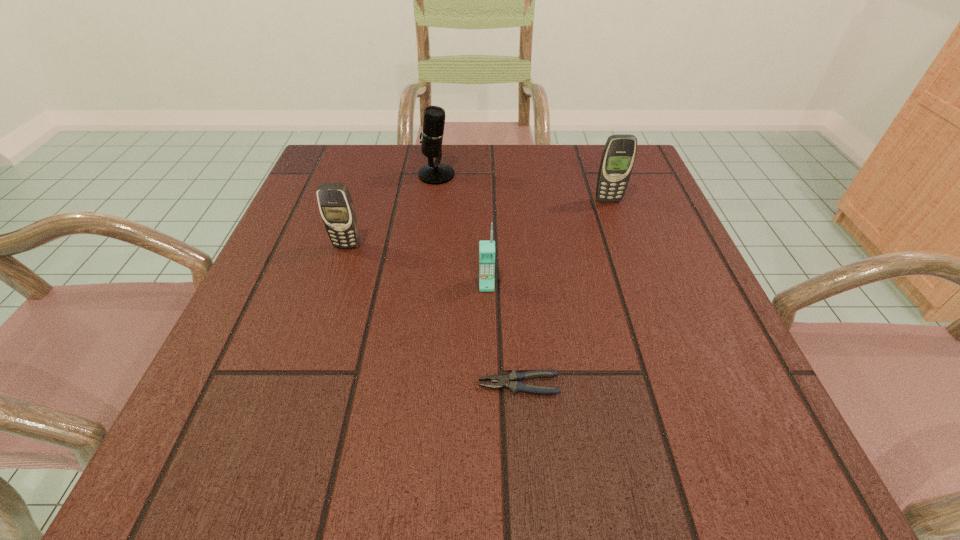
Where is `object that stands as the second closest to the farthest cellular telephone`? object that stands as the second closest to the farthest cellular telephone is located at coordinates (486, 248).

Locate an element on the screen. The width and height of the screenshot is (960, 540). cellular telephone that is the second closest to the second nearest cellular telephone is located at coordinates (619, 153).

You are a GUI agent. You are given a task and a screenshot of the screen. Output one action in this format:
    pyautogui.click(x=<x>, y=<y>)
    Task: Click on the closest cellular telephone to the shortest object
    
    Given the screenshot: What is the action you would take?
    pyautogui.click(x=486, y=248)

You are a GUI agent. You are given a task and a screenshot of the screen. Output one action in this format:
    pyautogui.click(x=<x>, y=<y>)
    Task: Click on the vacant point that satisfies the following two spatial constraints: 1. on the screen of the farthest cellular telephone; 2. at the gripping part of the nearest object
    The width and height of the screenshot is (960, 540).
    Given the screenshot: What is the action you would take?
    pyautogui.click(x=673, y=384)